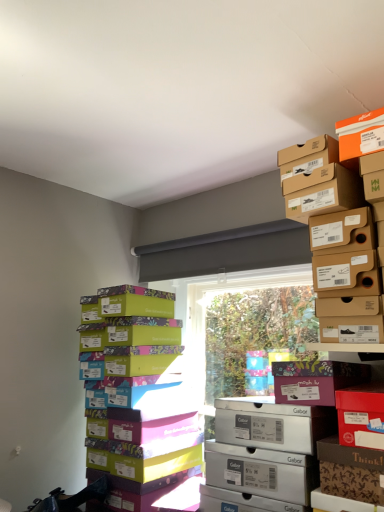
Question: Does multicolored cardboard shoebox at left appear on the right side of matte brown shoebox at upper right, acting as the 1th cardboard box starting from the top?

Choices:
 (A) yes
 (B) no

Answer: (B)

Question: Can you confirm if multicolored cardboard shoebox at left is wider than matte brown shoebox at upper right, acting as the 1th cardboard box starting from the top?

Choices:
 (A) no
 (B) yes

Answer: (B)

Question: Considering the relative sizes of multicolored cardboard shoebox at left and matte brown shoebox at upper right, acting as the 1th cardboard box starting from the top, in the image provided, is multicolored cardboard shoebox at left thinner than matte brown shoebox at upper right, acting as the 1th cardboard box starting from the top,?

Choices:
 (A) no
 (B) yes

Answer: (A)

Question: From a real-world perspective, is multicolored cardboard shoebox at left beneath matte brown shoebox at upper right, which is the 2th cardboard box in bottom-to-top order?

Choices:
 (A) no
 (B) yes

Answer: (B)

Question: Is multicolored cardboard shoebox at left to the left of matte brown shoebox at upper right, acting as the 1th cardboard box starting from the top, from the viewer's perspective?

Choices:
 (A) no
 (B) yes

Answer: (B)

Question: From the image's perspective, is matte brown shoebox at upper right, which is the 2th cardboard box in bottom-to-top order, positioned above or below floral-patterned cardboard box at center-right, positioned as the second cardboard box in top-to-bottom order?

Choices:
 (A) below
 (B) above

Answer: (B)

Question: From a real-world perspective, relative to floral-patterned cardboard box at center-right, positioned as the second cardboard box in top-to-bottom order, is matte brown shoebox at upper right, which is the 2th cardboard box in bottom-to-top order, vertically above or below?

Choices:
 (A) below
 (B) above

Answer: (B)

Question: Is matte brown shoebox at upper right, which is the 2th cardboard box in bottom-to-top order, wider or thinner than floral-patterned cardboard box at center-right, marked as the 1th cardboard box in a bottom-to-top arrangement?

Choices:
 (A) thin
 (B) wide

Answer: (B)

Question: From their relative heights in the image, would you say matte brown shoebox at upper right, acting as the 1th cardboard box starting from the top, is taller or shorter than floral-patterned cardboard box at center-right, positioned as the second cardboard box in top-to-bottom order?

Choices:
 (A) tall
 (B) short

Answer: (A)

Question: Would you say multicolored cardboard shoebox at left is inside or outside matte brown shoebox at upper right, which is the 2th cardboard box in bottom-to-top order?

Choices:
 (A) inside
 (B) outside

Answer: (B)

Question: Considering the positions of multicolored cardboard shoebox at left and matte brown shoebox at upper right, acting as the 1th cardboard box starting from the top, in the image, is multicolored cardboard shoebox at left bigger or smaller than matte brown shoebox at upper right, acting as the 1th cardboard box starting from the top,?

Choices:
 (A) big
 (B) small

Answer: (A)

Question: Is multicolored cardboard shoebox at left to the left or to the right of matte brown shoebox at upper right, acting as the 1th cardboard box starting from the top, in the image?

Choices:
 (A) right
 (B) left

Answer: (B)

Question: From a real-world perspective, is multicolored cardboard shoebox at left above or below matte brown shoebox at upper right, which is the 2th cardboard box in bottom-to-top order?

Choices:
 (A) below
 (B) above

Answer: (A)

Question: Is point (256, 487) closer or farther from the camera than point (317, 394)?

Choices:
 (A) farther
 (B) closer

Answer: (A)

Question: Considering the positions of white cardboard shoebox at center and floral-patterned cardboard box at center-right, marked as the 1th cardboard box in a bottom-to-top arrangement, in the image, is white cardboard shoebox at center wider or thinner than floral-patterned cardboard box at center-right, marked as the 1th cardboard box in a bottom-to-top arrangement,?

Choices:
 (A) wide
 (B) thin

Answer: (B)